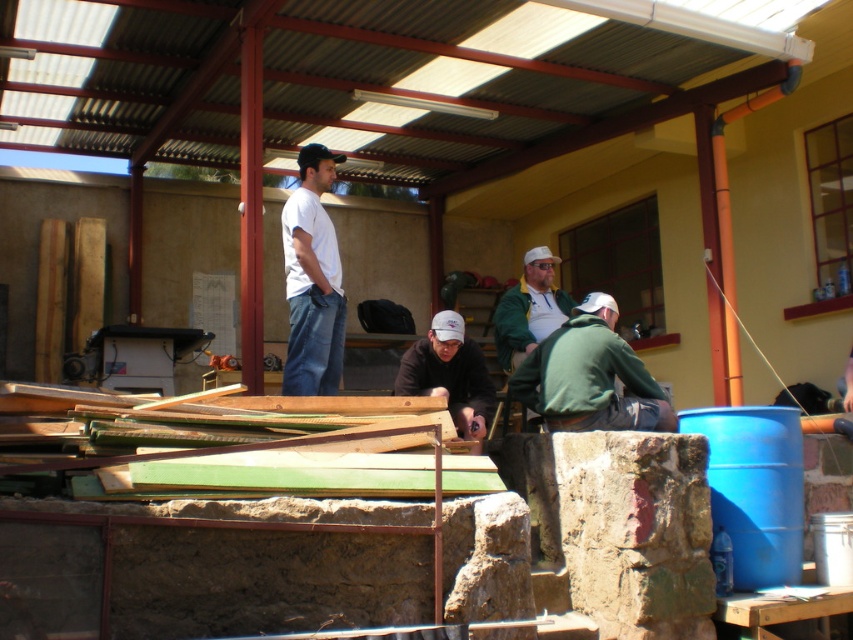
Question: Based on their relative distances, which object is nearer to the green matte jacket at lower right?

Choices:
 (A) white cotton shirt at center
 (B) green fuzzy jacket at center

Answer: (B)

Question: Is white cotton shirt at center closer to camera compared to green fuzzy jacket at center?

Choices:
 (A) no
 (B) yes

Answer: (B)

Question: Considering the relative positions of white cotton shirt at center and green fuzzy jacket at center in the image provided, where is white cotton shirt at center located with respect to green fuzzy jacket at center?

Choices:
 (A) right
 (B) left

Answer: (B)

Question: Which object is the farthest from the green fuzzy jacket at center?

Choices:
 (A) white matte baseball cap at center
 (B) white cotton shirt at center
 (C) green matte jacket at lower right

Answer: (B)

Question: Does white matte baseball cap at center appear on the left side of green fuzzy jacket at center?

Choices:
 (A) no
 (B) yes

Answer: (B)

Question: Which point is farther from the camera taking this photo?

Choices:
 (A) (529, 273)
 (B) (323, 160)

Answer: (A)